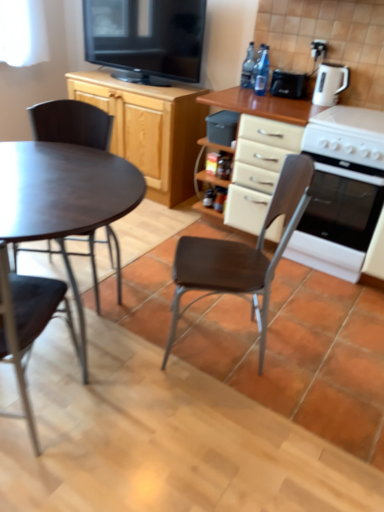
Question: From a real-world perspective, is black glossy television at upper center positioned above or below white glossy electric kettle at upper right?

Choices:
 (A) above
 (B) below

Answer: (A)

Question: In terms of width, does black glossy television at upper center look wider or thinner when compared to white glossy electric kettle at upper right?

Choices:
 (A) thin
 (B) wide

Answer: (B)

Question: Which of these objects is positioned farthest from the white glossy oven at right?

Choices:
 (A) wooden cabinet at upper left
 (B) white glossy electric kettle at upper right
 (C) matte black chair at left, which appears as the second chair when viewed from the left
 (D) matte wood cabinet at center
 (E) metallic dark brown chair at left, the first chair from the left

Answer: (E)

Question: Which object is the closest to the brown leather chair at center, which appears as the 1th chair when viewed from the right?

Choices:
 (A) matte wood cabinet at center
 (B) black plastic toaster at upper right, placed as the 1th appliance when sorted from top to bottom
 (C) black plastic container at center, marked as the first appliance in a left-to-right arrangement
 (D) transparent plastic bottles at upper center, arranged as the 2th bottle when viewed from the front
 (E) white glossy oven at right

Answer: (E)